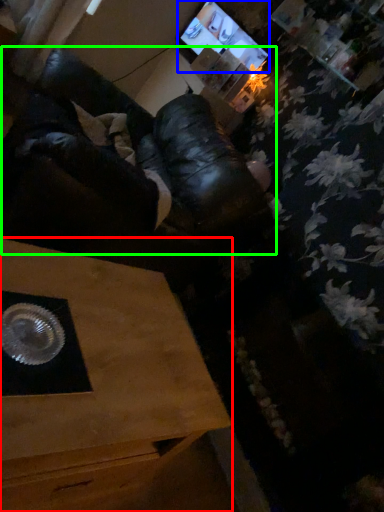
Question: Estimate the real-world distances between objects in this image. Which object is farther from table (highlighted by a red box), computer monitor (highlighted by a blue box) or squat (highlighted by a green box)?

Choices:
 (A) computer monitor
 (B) squat

Answer: (A)